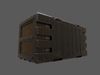
Locate an element on the screen. The height and width of the screenshot is (75, 100). left end of chest is located at coordinates (27, 32), (27, 43).